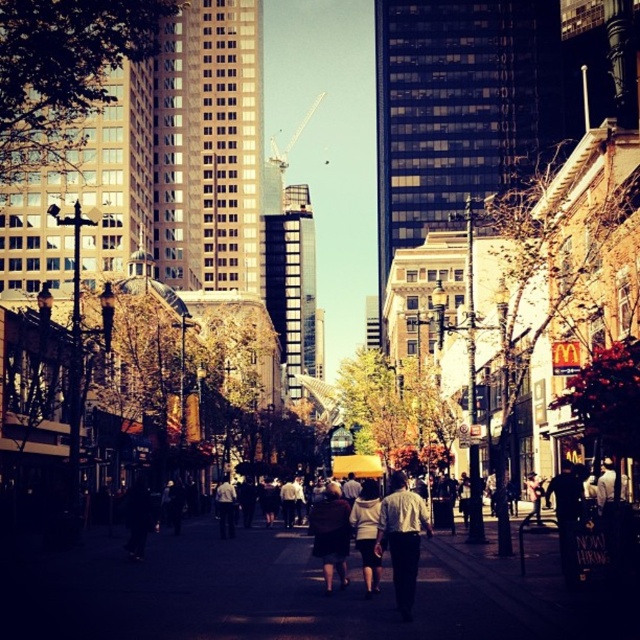
You are a delivery person standing on the dark gray concrete sidewalk at center and need to pick up the dark brown leather jacket at center. Can you reach it without stepping off the sidewalk?

The dark gray concrete sidewalk at center is in front of the dark brown leather jacket at center, meaning the jacket is behind the sidewalk. Since you are standing on the sidewalk, you would need to step off to reach the jacket, so you cannot reach it without stepping off the sidewalk.